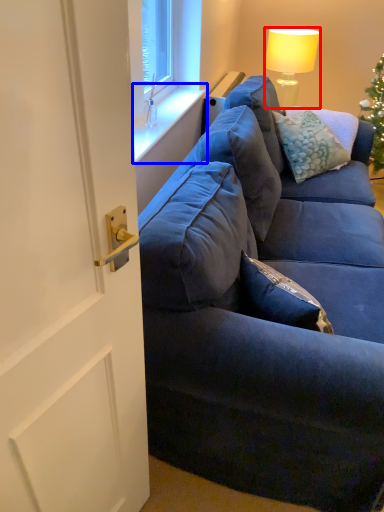
Question: Which of the following is the farthest to the observer, lamp (highlighted by a red box) or window sill (highlighted by a blue box)?

Choices:
 (A) lamp
 (B) window sill

Answer: (A)